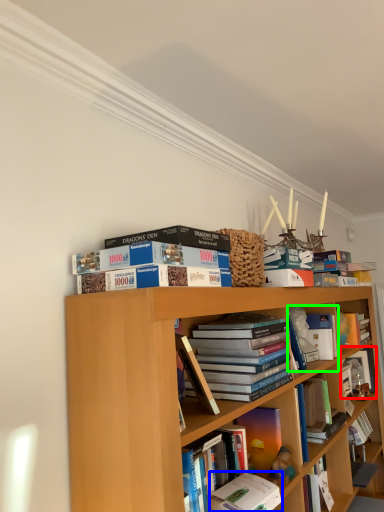
Question: Which object is the closest to the book (highlighted by a red box)? Choose among these: book (highlighted by a blue box) or book (highlighted by a green box).

Choices:
 (A) book
 (B) book

Answer: (B)